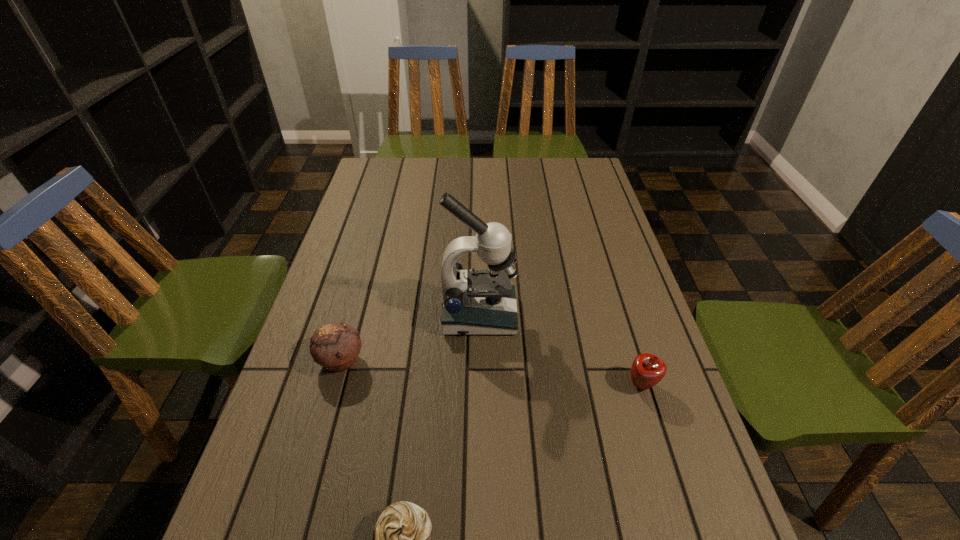
What are the coordinates of `microscope` in the screenshot? It's located at (478, 302).

The width and height of the screenshot is (960, 540). Identify the location of the farthest object. (478, 302).

Locate an element on the screen. the leftmost object is located at coordinates (336, 346).

At what (x,y) coordinates should I click in order to perform the action: click on the taller muffin. Please return your answer as a coordinate pair (x, y). Looking at the image, I should click on (336, 346).

Find the location of a particular element. The height and width of the screenshot is (540, 960). the rightmost object is located at coordinates (647, 370).

Where is `blank space located 0.240m at the eyepiece of the tallest object`? This screenshot has width=960, height=540. blank space located 0.240m at the eyepiece of the tallest object is located at coordinates (608, 315).

This screenshot has width=960, height=540. Identify the location of free space located 0.260m on the back of the farther muffin. (366, 271).

At what (x,y) coordinates should I click in order to perform the action: click on blank space located 0.400m on the left of the rightmost object. Please return your answer as a coordinate pair (x, y). Looking at the image, I should click on (449, 384).

In order to click on object located at the left edge in this screenshot , I will do `click(336, 346)`.

Image resolution: width=960 pixels, height=540 pixels. I want to click on object present at the right edge, so click(x=647, y=370).